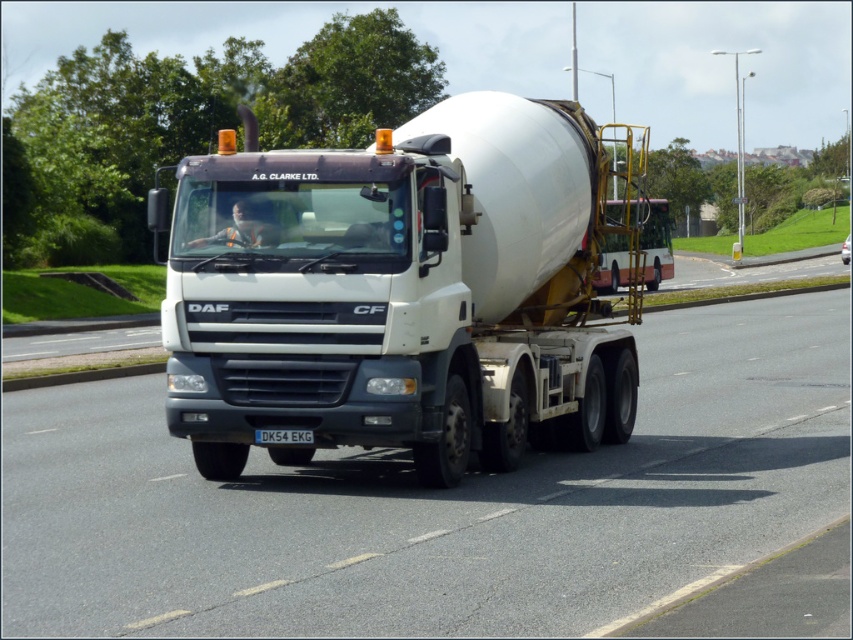
Who is more distant from viewer, (33, 456) or (437, 392)?

The point (33, 456) is more distant.

In the scene shown: Which is above, white glossy concrete mixer truck at center or white matte trailer truck at center?

white matte trailer truck at center is higher up.

Which is behind, point (819, 500) or point (485, 188)?

The point (485, 188) is more distant.

This screenshot has width=853, height=640. In order to click on white glossy concrete mixer truck at center in this screenshot , I will do `click(431, 502)`.